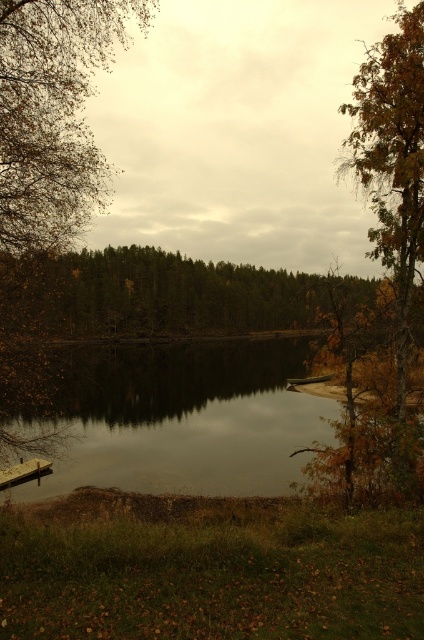
Question: Which of the following is the closest to the observer?

Choices:
 (A) brown leafy tree at right
 (B) brown leafy tree at left

Answer: (B)

Question: Can you confirm if brown leafy tree at right is smaller than brown leafy tree at left?

Choices:
 (A) no
 (B) yes

Answer: (A)

Question: Which point is farther from the camera taking this photo?

Choices:
 (A) (86, 65)
 (B) (367, 65)

Answer: (B)

Question: Is the position of brown leafy tree at right less distant than that of brown leafy tree at left?

Choices:
 (A) yes
 (B) no

Answer: (B)

Question: From the image, what is the correct spatial relationship of brown leafy tree at right in relation to brown leafy tree at left?

Choices:
 (A) right
 (B) left

Answer: (A)